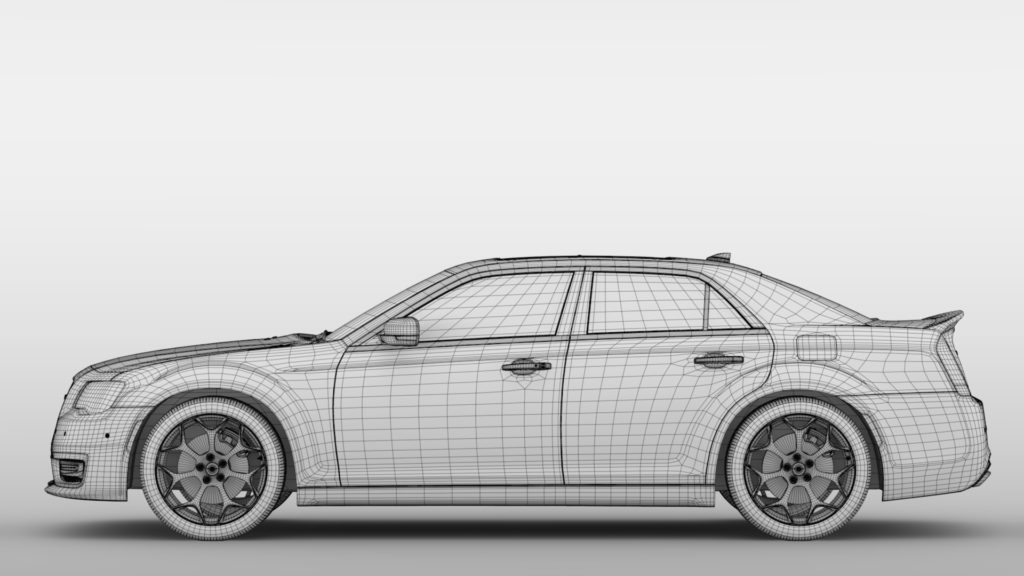
Locate an element on the screen. The width and height of the screenshot is (1024, 576). window is located at coordinates (509, 314).